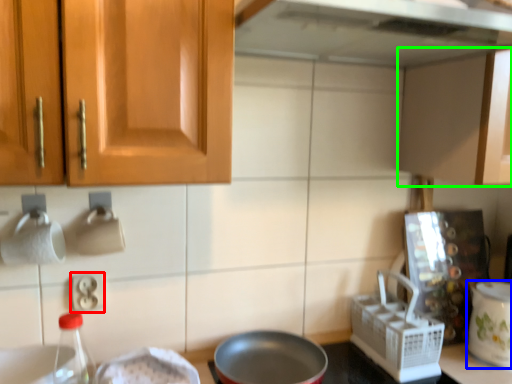
Question: Which object is the farthest from electric outlet (highlighted by a red box)? Choose among these: kitchen appliance (highlighted by a blue box) or cabinetry (highlighted by a green box).

Choices:
 (A) kitchen appliance
 (B) cabinetry

Answer: (A)